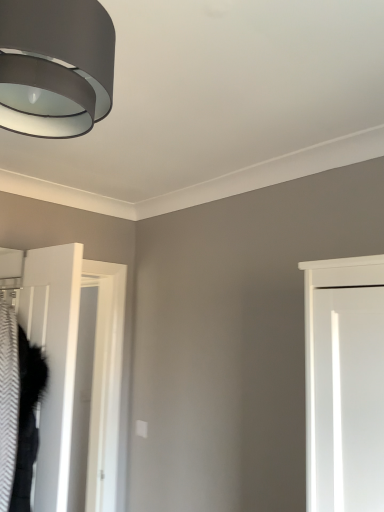
Question: From the image's perspective, does white matte door at left appear higher than matte black lampshade at upper left?

Choices:
 (A) yes
 (B) no

Answer: (B)

Question: Is white matte door at left taller than matte black lampshade at upper left?

Choices:
 (A) yes
 (B) no

Answer: (A)

Question: From a real-world perspective, is white matte door at left physically above matte black lampshade at upper left?

Choices:
 (A) yes
 (B) no

Answer: (B)

Question: Does white matte door at left have a smaller size compared to matte black lampshade at upper left?

Choices:
 (A) no
 (B) yes

Answer: (A)

Question: Considering the relative sizes of white matte door at left and matte black lampshade at upper left in the image provided, is white matte door at left thinner than matte black lampshade at upper left?

Choices:
 (A) yes
 (B) no

Answer: (A)

Question: Is white matte door at left in front of matte black lampshade at upper left?

Choices:
 (A) no
 (B) yes

Answer: (A)

Question: From a real-world perspective, is matte black lampshade at upper left physically below white matte door at left?

Choices:
 (A) yes
 (B) no

Answer: (B)

Question: Is matte black lampshade at upper left at the left side of white matte door at left?

Choices:
 (A) yes
 (B) no

Answer: (B)

Question: Can you confirm if matte black lampshade at upper left is thinner than white matte door at left?

Choices:
 (A) yes
 (B) no

Answer: (B)

Question: From a real-world perspective, is matte black lampshade at upper left on top of white matte door at left?

Choices:
 (A) yes
 (B) no

Answer: (A)

Question: Is matte black lampshade at upper left outside of white matte door at left?

Choices:
 (A) yes
 (B) no

Answer: (A)

Question: Does matte black lampshade at upper left come behind white matte door at left?

Choices:
 (A) yes
 (B) no

Answer: (B)

Question: In the image, is matte black lampshade at upper left on the left side or the right side of white matte door at left?

Choices:
 (A) left
 (B) right

Answer: (B)